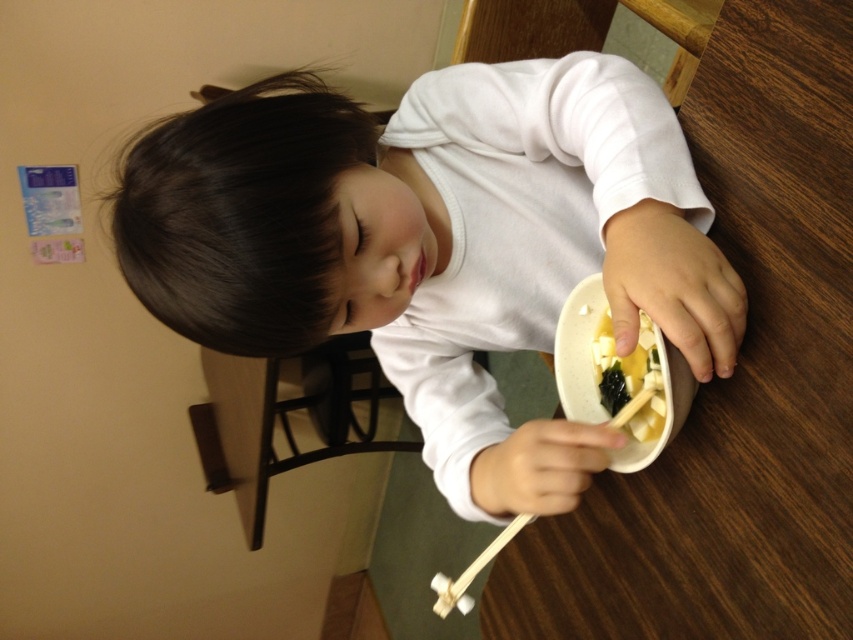
Does white matte shirt at center have a greater width compared to yellow matte tofu at center?

Indeed, white matte shirt at center has a greater width compared to yellow matte tofu at center.

Can you confirm if white matte shirt at center is taller than yellow matte tofu at center?

Correct, white matte shirt at center is much taller as yellow matte tofu at center.

Is point (476, 136) positioned behind point (636, 419)?

Yes, point (476, 136) is farther from viewer.

Identify the location of white matte shirt at center. The image size is (853, 640). (434, 244).